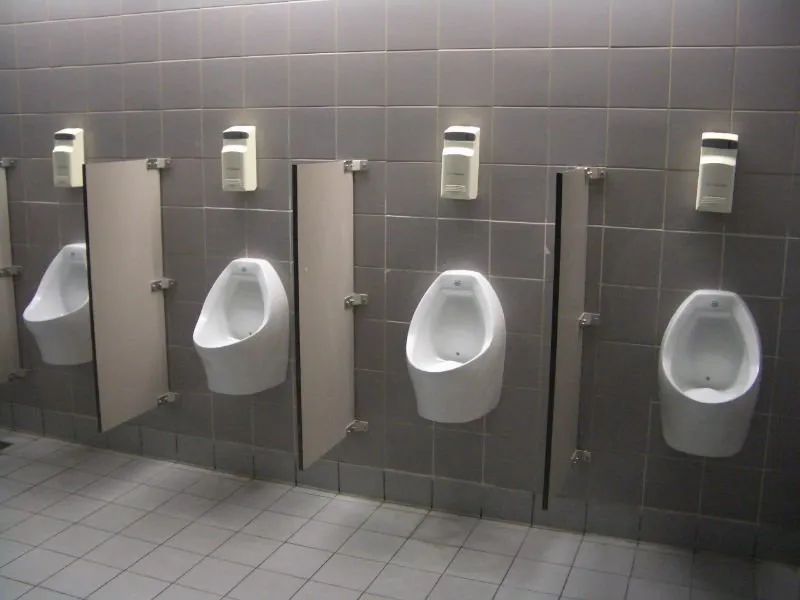
You are a GUI agent. You are given a task and a screenshot of the screen. Output one action in this format:
    pyautogui.click(x=<x>, y=<y>)
    Task: Click on the urinals
    This screenshot has width=800, height=600.
    Given the screenshot: What is the action you would take?
    pyautogui.click(x=64, y=314), pyautogui.click(x=212, y=346), pyautogui.click(x=474, y=354), pyautogui.click(x=698, y=381)